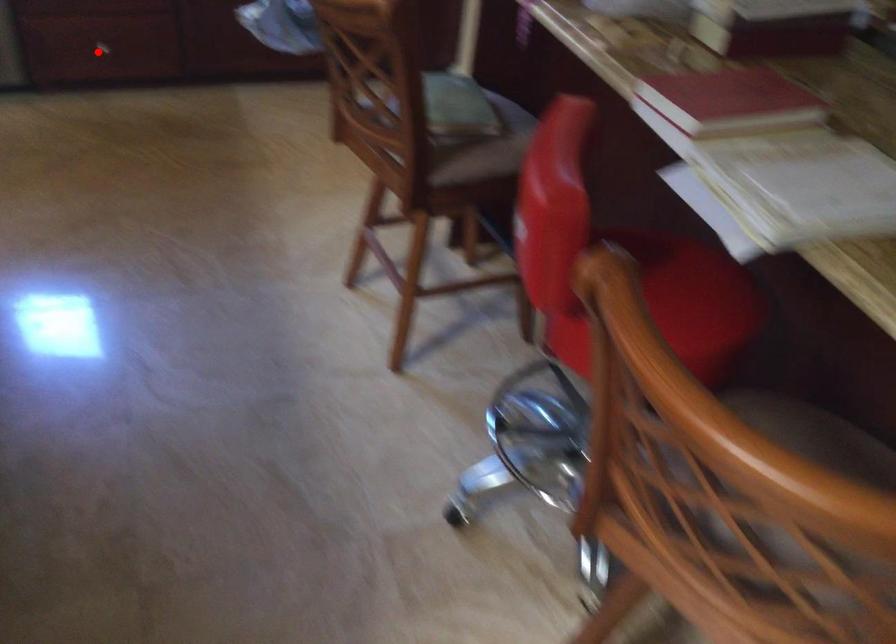
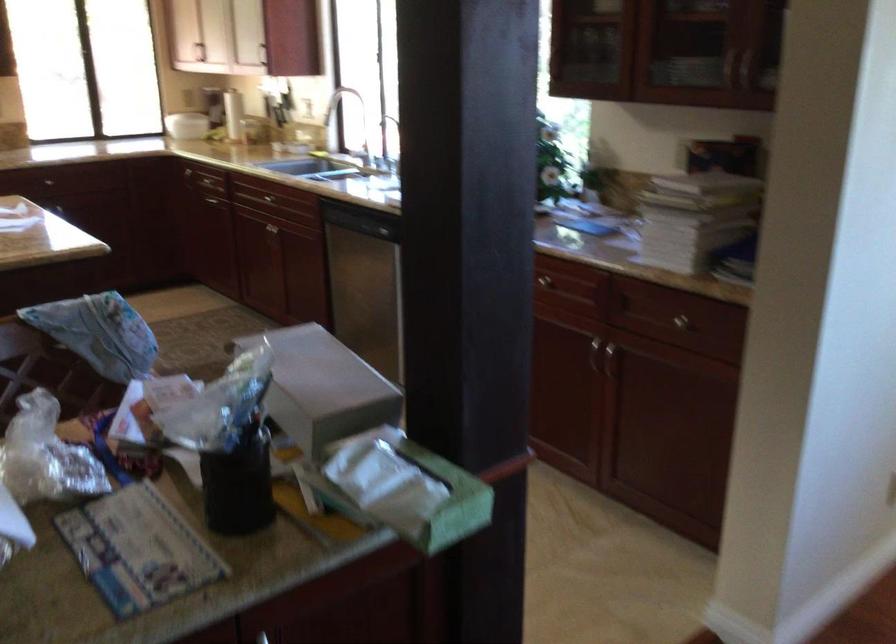
Question: I am providing you with two images of the same scene from different viewpoints. A red point is marked on the first image. Can you still see the location of the red point in image 2?

Choices:
 (A) Yes
 (B) No

Answer: (B)